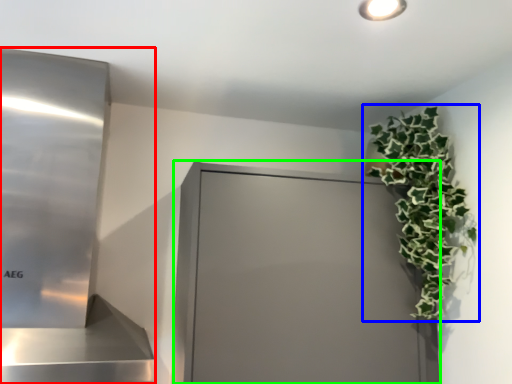
Question: Which is nearer to the appliance (highlighted by a red box)? houseplant (highlighted by a blue box) or glass door (highlighted by a green box).

Choices:
 (A) houseplant
 (B) glass door

Answer: (B)